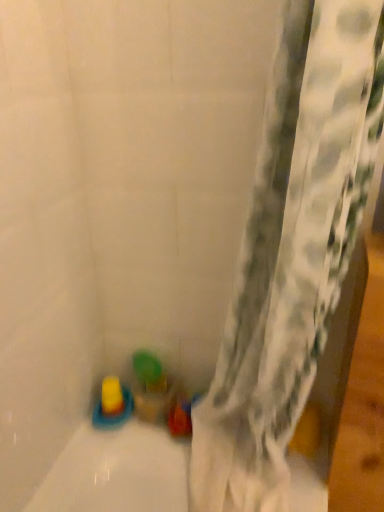
Locate an element on the screen. Image resolution: width=384 pixels, height=512 pixels. yellow rubber toy at lower left, marked as the 3th toy in a right-to-left arrangement is located at coordinates (112, 397).

This screenshot has height=512, width=384. Describe the element at coordinates (112, 404) in the screenshot. I see `translucent yellow toy at bottom left, the 2th toy when ordered from right to left` at that location.

You are a GUI agent. You are given a task and a screenshot of the screen. Output one action in this format:
    pyautogui.click(x=<x>, y=<y>)
    Task: Click on the translucent plastic cup at lower center, positioned as the first toy in right-to-left order
    This screenshot has width=384, height=512.
    Given the screenshot: What is the action you would take?
    pyautogui.click(x=150, y=387)

The width and height of the screenshot is (384, 512). In order to click on yellow rubber toy at lower left, arranged as the first toy when viewed from the left in this screenshot , I will do `click(112, 397)`.

From the image's perspective, between yellow rubber toy at lower left, arranged as the first toy when viewed from the left, and translucent plastic cup at lower center, positioned as the first toy in right-to-left order, which one is located above?

yellow rubber toy at lower left, arranged as the first toy when viewed from the left, appears higher in the image.

From a real-world perspective, which object stands above the other?

yellow rubber toy at lower left, marked as the 3th toy in a right-to-left arrangement, is physically above.

Which is closer, (110, 407) or (137, 381)?

The point (110, 407) is in front.

Considering the relative sizes of yellow rubber toy at lower left, marked as the 3th toy in a right-to-left arrangement, and translucent plastic cup at lower center, the third toy from the left, in the image provided, is yellow rubber toy at lower left, marked as the 3th toy in a right-to-left arrangement, taller than translucent plastic cup at lower center, the third toy from the left,?

In fact, yellow rubber toy at lower left, marked as the 3th toy in a right-to-left arrangement, may be shorter than translucent plastic cup at lower center, the third toy from the left.

Considering the sizes of objects translucent plastic cup at lower center, positioned as the first toy in right-to-left order, and yellow rubber toy at lower left, marked as the 3th toy in a right-to-left arrangement, in the image provided, who is bigger, translucent plastic cup at lower center, positioned as the first toy in right-to-left order, or yellow rubber toy at lower left, marked as the 3th toy in a right-to-left arrangement,?

Bigger between the two is translucent plastic cup at lower center, positioned as the first toy in right-to-left order.

Which object is thinner, translucent plastic cup at lower center, the third toy from the left, or yellow rubber toy at lower left, arranged as the first toy when viewed from the left?

Thinner between the two is translucent plastic cup at lower center, the third toy from the left.

Is translucent plastic cup at lower center, the third toy from the left, aimed at yellow rubber toy at lower left, arranged as the first toy when viewed from the left?

No, translucent plastic cup at lower center, the third toy from the left, is not oriented towards yellow rubber toy at lower left, arranged as the first toy when viewed from the left.

Which of these two, translucent yellow toy at bottom left, which is counted as the second toy, starting from the left, or yellow rubber toy at lower left, arranged as the first toy when viewed from the left, is smaller?

With smaller size is yellow rubber toy at lower left, arranged as the first toy when viewed from the left.

Between point (112, 394) and point (114, 398), which one is positioned in front?

The point (112, 394) is more forward.

From the image's perspective, who appears lower, translucent yellow toy at bottom left, the 2th toy when ordered from right to left, or yellow rubber toy at lower left, arranged as the first toy when viewed from the left?

translucent yellow toy at bottom left, the 2th toy when ordered from right to left, from the image's perspective.

Which object is further away from the camera taking this photo, translucent yellow toy at bottom left, which is counted as the second toy, starting from the left, or yellow rubber toy at lower left, arranged as the first toy when viewed from the left?

yellow rubber toy at lower left, arranged as the first toy when viewed from the left, is further from the camera.

Looking at their sizes, would you say translucent yellow toy at bottom left, which is counted as the second toy, starting from the left, is wider or thinner than translucent plastic cup at lower center, the third toy from the left?

Considering their sizes, translucent yellow toy at bottom left, which is counted as the second toy, starting from the left, looks broader than translucent plastic cup at lower center, the third toy from the left.

Is point (94, 422) closer to camera compared to point (152, 403)?

No, it is behind (152, 403).

Does translucent yellow toy at bottom left, which is counted as the second toy, starting from the left, appear on the left side of translucent plastic cup at lower center, positioned as the first toy in right-to-left order?

Yes, translucent yellow toy at bottom left, which is counted as the second toy, starting from the left, is to the left of translucent plastic cup at lower center, positioned as the first toy in right-to-left order.

Consider the image. Can translucent plastic cup at lower center, the third toy from the left, be found inside translucent yellow toy at bottom left, which is counted as the second toy, starting from the left?

Actually, translucent plastic cup at lower center, the third toy from the left, is outside translucent yellow toy at bottom left, which is counted as the second toy, starting from the left.

Is point (137, 398) positioned in front of point (111, 423)?

That is False.

Does translucent plastic cup at lower center, the third toy from the left, have a lesser width compared to translucent yellow toy at bottom left, the 2th toy when ordered from right to left?

Correct, the width of translucent plastic cup at lower center, the third toy from the left, is less than that of translucent yellow toy at bottom left, the 2th toy when ordered from right to left.

Looking at this image, is translucent plastic cup at lower center, positioned as the first toy in right-to-left order, inside the boundaries of translucent yellow toy at bottom left, the 2th toy when ordered from right to left, or outside?

translucent plastic cup at lower center, positioned as the first toy in right-to-left order, is outside translucent yellow toy at bottom left, the 2th toy when ordered from right to left.

From a real-world perspective, which is physically above, translucent plastic cup at lower center, positioned as the first toy in right-to-left order, or translucent yellow toy at bottom left, which is counted as the second toy, starting from the left?

translucent plastic cup at lower center, positioned as the first toy in right-to-left order, from a real-world perspective.

Is translucent yellow toy at bottom left, the 2th toy when ordered from right to left, at the back of yellow rubber toy at lower left, marked as the 3th toy in a right-to-left arrangement?

No, yellow rubber toy at lower left, marked as the 3th toy in a right-to-left arrangement,'s orientation is not away from translucent yellow toy at bottom left, the 2th toy when ordered from right to left.

Who is smaller, yellow rubber toy at lower left, marked as the 3th toy in a right-to-left arrangement, or translucent yellow toy at bottom left, which is counted as the second toy, starting from the left?

With smaller size is yellow rubber toy at lower left, marked as the 3th toy in a right-to-left arrangement.

In the scene shown: From the image's perspective, is yellow rubber toy at lower left, marked as the 3th toy in a right-to-left arrangement, located above or below translucent yellow toy at bottom left, which is counted as the second toy, starting from the left?

From the image's perspective, yellow rubber toy at lower left, marked as the 3th toy in a right-to-left arrangement, appears above translucent yellow toy at bottom left, which is counted as the second toy, starting from the left.

Locate an element on the screen. This screenshot has height=512, width=384. toy behind the translucent plastic cup at lower center, the third toy from the left is located at coordinates [x=112, y=397].

There is a yellow rubber toy at lower left, arranged as the first toy when viewed from the left. Identify the location of the 1st toy below it (from the image's perspective). The height and width of the screenshot is (512, 384). (150, 387).

Looking at the image, which one is located closer to translucent plastic cup at lower center, the third toy from the left, translucent yellow toy at bottom left, the 2th toy when ordered from right to left, or yellow rubber toy at lower left, arranged as the first toy when viewed from the left?

translucent yellow toy at bottom left, the 2th toy when ordered from right to left.

From the image, which object appears to be nearer to translucent plastic cup at lower center, the third toy from the left, yellow rubber toy at lower left, marked as the 3th toy in a right-to-left arrangement, or translucent yellow toy at bottom left, which is counted as the second toy, starting from the left?

translucent yellow toy at bottom left, which is counted as the second toy, starting from the left.

From the image, which object appears to be farther from translucent yellow toy at bottom left, the 2th toy when ordered from right to left, yellow rubber toy at lower left, arranged as the first toy when viewed from the left, or translucent plastic cup at lower center, positioned as the first toy in right-to-left order?

translucent plastic cup at lower center, positioned as the first toy in right-to-left order, is positioned further to the anchor translucent yellow toy at bottom left, the 2th toy when ordered from right to left.

Which object lies nearer to the anchor point yellow rubber toy at lower left, arranged as the first toy when viewed from the left, translucent yellow toy at bottom left, which is counted as the second toy, starting from the left, or translucent plastic cup at lower center, the third toy from the left?

The object closer to yellow rubber toy at lower left, arranged as the first toy when viewed from the left, is translucent yellow toy at bottom left, which is counted as the second toy, starting from the left.

Estimate the real-world distances between objects in this image. Which object is further from translucent yellow toy at bottom left, which is counted as the second toy, starting from the left, translucent plastic cup at lower center, the third toy from the left, or yellow rubber toy at lower left, marked as the 3th toy in a right-to-left arrangement?

translucent plastic cup at lower center, the third toy from the left, lies further to translucent yellow toy at bottom left, which is counted as the second toy, starting from the left, than the other object.

Estimate the real-world distances between objects in this image. Which object is further from yellow rubber toy at lower left, marked as the 3th toy in a right-to-left arrangement, translucent plastic cup at lower center, positioned as the first toy in right-to-left order, or translucent yellow toy at bottom left, the 2th toy when ordered from right to left?

translucent plastic cup at lower center, positioned as the first toy in right-to-left order.

This screenshot has width=384, height=512. Identify the location of toy between yellow rubber toy at lower left, arranged as the first toy when viewed from the left, and translucent plastic cup at lower center, positioned as the first toy in right-to-left order. (112, 404).